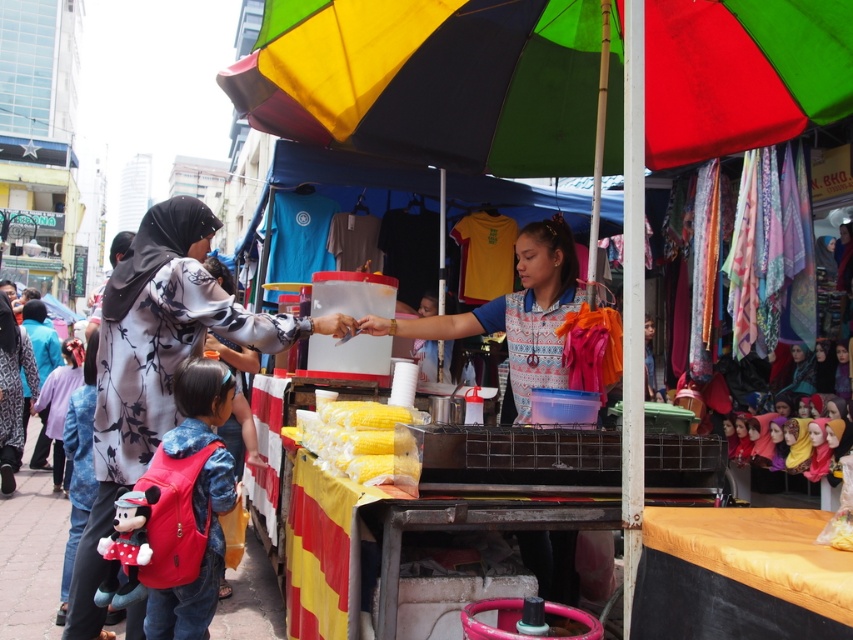
Question: Estimate the real-world distances between objects in this image. Which object is closer to the floral fabric hijab at left?

Choices:
 (A) red fabric backpack at lower left
 (B) rainbow fabric umbrella at center

Answer: (A)

Question: Is rainbow fabric umbrella at center smaller than red fabric backpack at lower left?

Choices:
 (A) yes
 (B) no

Answer: (B)

Question: Among these objects, which one is nearest to the camera?

Choices:
 (A) matte blue shirt at center
 (B) red fabric backpack at lower left
 (C) rainbow fabric umbrella at center

Answer: (B)

Question: Does rainbow fabric umbrella at center appear on the right side of floral fabric hijab at left?

Choices:
 (A) no
 (B) yes

Answer: (B)

Question: Is floral fabric hijab at left bigger than yellow matte corn at center?

Choices:
 (A) no
 (B) yes

Answer: (B)

Question: Considering the real-world distances, which object is farthest from the matte blue shirt at center?

Choices:
 (A) yellow matte corn at center
 (B) rainbow fabric umbrella at center
 (C) floral fabric hijab at left
 (D) red fabric backpack at lower left

Answer: (D)